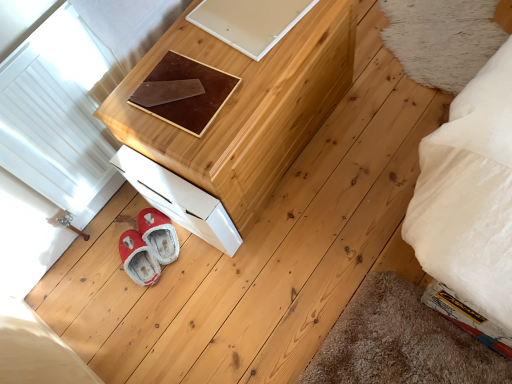
Locate an element on the screen. free space between white glossy drawer at lower left and fuzzy red slippers at lower left is located at coordinates (167, 245).